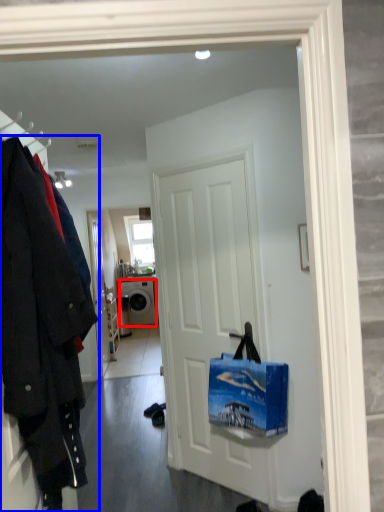
Question: Which of the following is the farthest to the observer, washing machine (highlighted by a red box) or coat (highlighted by a blue box)?

Choices:
 (A) washing machine
 (B) coat

Answer: (A)